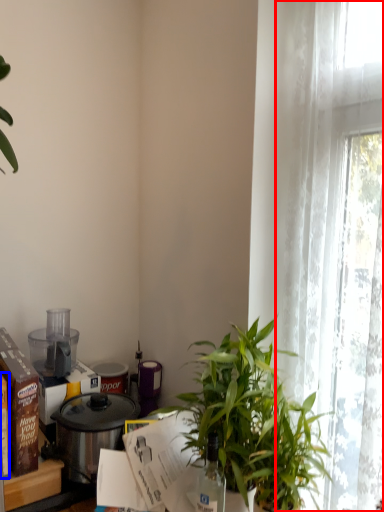
Question: Which object is closer to the camera taking this photo, curtain (highlighted by a red box) or box (highlighted by a blue box)?

Choices:
 (A) curtain
 (B) box

Answer: (A)